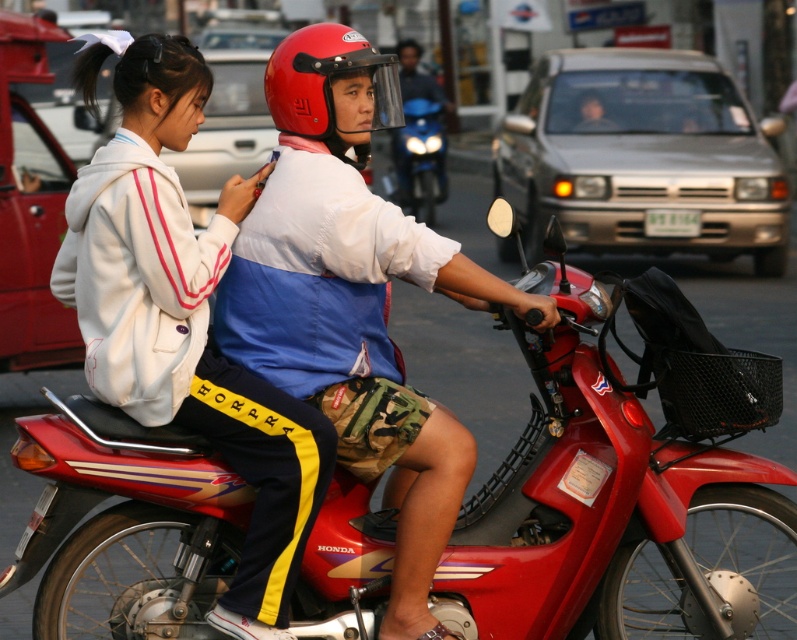
Question: Based on their relative distances, which object is farther from the matte blue shirt at center?

Choices:
 (A) metallic red motorcycle at center
 (B) metallic blue motorcycle at center
 (C) white fleece jacket at upper left
 (D) red matte helmet at center

Answer: (B)

Question: Does matte blue shirt at center appear under white fleece jacket at upper left?

Choices:
 (A) yes
 (B) no

Answer: (B)

Question: Can you confirm if metallic red motorcycle at center is positioned above red matte helmet at center?

Choices:
 (A) yes
 (B) no

Answer: (B)

Question: Which object is positioned farthest from the white fleece jacket at upper left?

Choices:
 (A) matte blue shirt at center
 (B) metallic red motorcycle at center

Answer: (B)

Question: Based on their relative distances, which object is farther from the red matte helmet at center?

Choices:
 (A) metallic blue motorcycle at center
 (B) white fleece jacket at upper left

Answer: (A)

Question: Is white fleece jacket at upper left above red matte helmet at center?

Choices:
 (A) no
 (B) yes

Answer: (A)